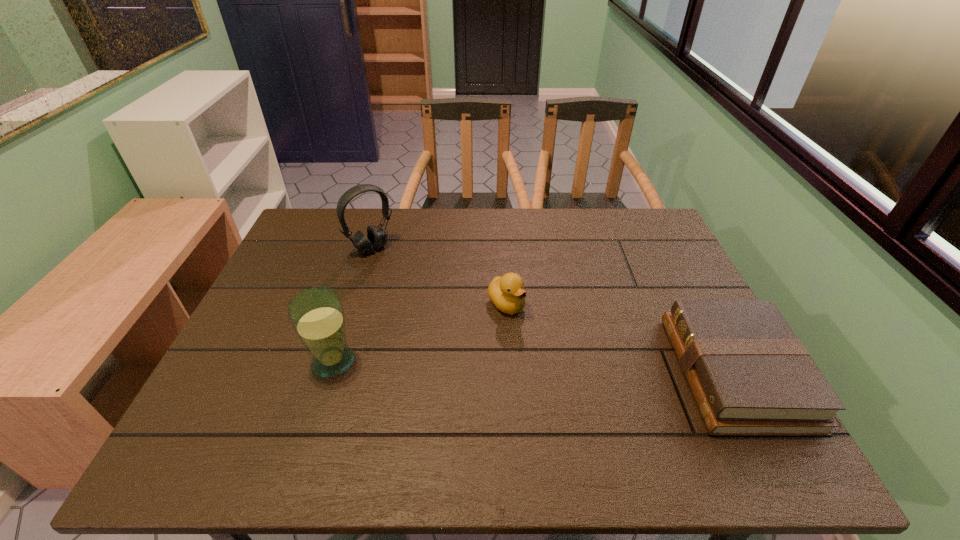
This screenshot has width=960, height=540. What are the coordinates of `glass` in the screenshot? It's located at (x=316, y=314).

This screenshot has height=540, width=960. What are the coordinates of `the shortest object` in the screenshot? It's located at click(x=750, y=375).

Find the location of `Bible`. Bible is located at coordinates (750, 375).

You are a GUI agent. You are given a task and a screenshot of the screen. Output one action in this format:
    pyautogui.click(x=<x>, y=<y>)
    Task: Click on the farthest object
    
    Given the screenshot: What is the action you would take?
    pyautogui.click(x=376, y=238)

This screenshot has width=960, height=540. Identify the location of the second farthest object. (507, 293).

This screenshot has height=540, width=960. I want to click on the third object from left to right, so click(507, 293).

The image size is (960, 540). What are the coordinates of `vacant space located 0.320m on the back of the glass` in the screenshot? It's located at (365, 261).

The image size is (960, 540). I want to click on free point located on the spine side of the shortest object, so click(611, 373).

Locate an element on the screen. Image resolution: width=960 pixels, height=540 pixels. free space located 0.070m on the spine side of the shortest object is located at coordinates (650, 373).

The height and width of the screenshot is (540, 960). Identify the location of vacant space situated on the spine side of the shortest object. (571, 373).